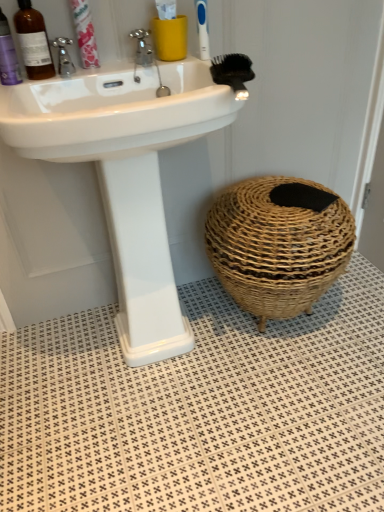
Image resolution: width=384 pixels, height=512 pixels. What are the coordinates of `free point above braided wicker basket at lower right (from a real-world perspective)` in the screenshot? It's located at (289, 203).